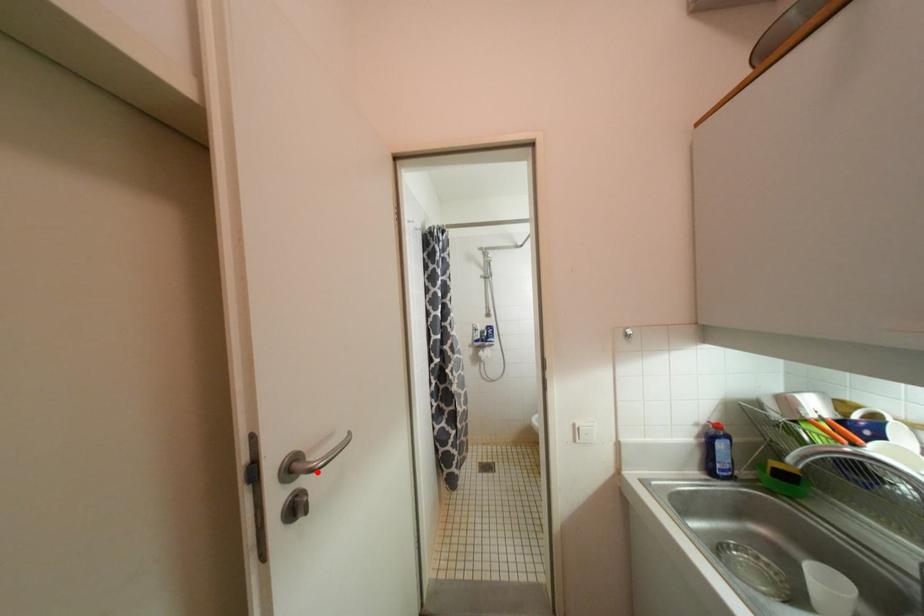
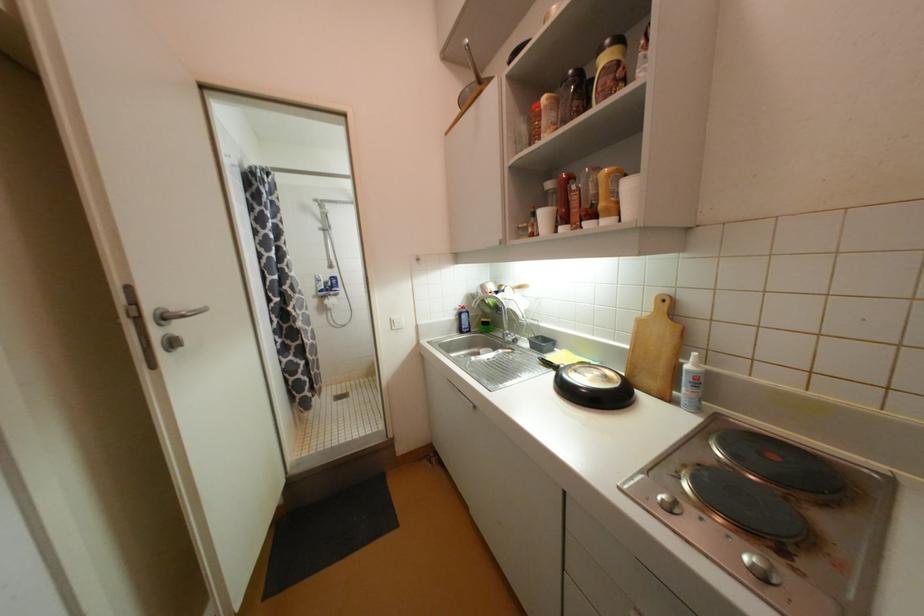
Where in the second image is the point corresponding to the highlighted location from the first image?

(188, 318)